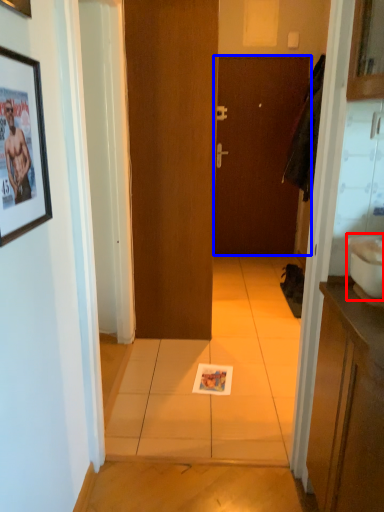
Question: Among these objects, which one is farthest to the camera, sink (highlighted by a red box) or door (highlighted by a blue box)?

Choices:
 (A) sink
 (B) door

Answer: (B)